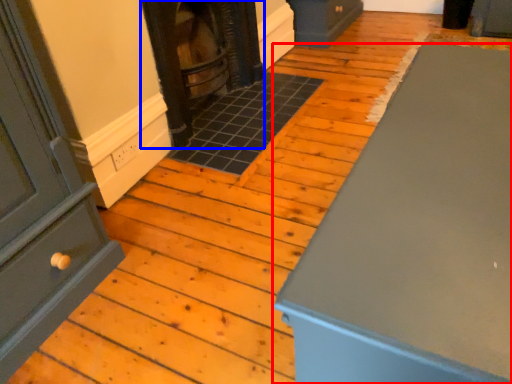
Question: Among these objects, which one is nearest to the camera, furniture (highlighted by a red box) or stove (highlighted by a blue box)?

Choices:
 (A) furniture
 (B) stove

Answer: (A)